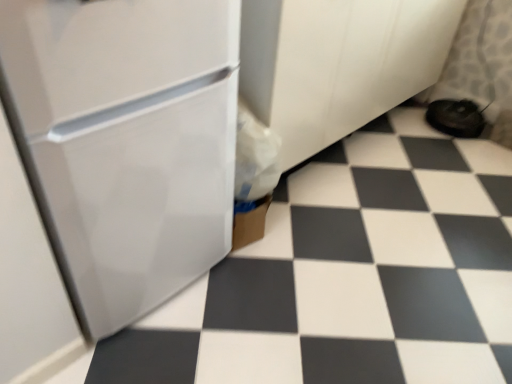
What do you see at coordinates (125, 142) in the screenshot?
I see `white glossy refrigerator at left` at bounding box center [125, 142].

Where is `white glossy tile at center`? Image resolution: width=512 pixels, height=384 pixels. white glossy tile at center is located at coordinates (351, 275).

Which of these two, white glossy tile at center or black fabric shoe at lower right, is thinner?

Thinner between the two is black fabric shoe at lower right.

Is white glossy tile at center facing away from black fabric shoe at lower right?

white glossy tile at center is not turned away from black fabric shoe at lower right.

Does white glossy tile at center have a smaller size compared to black fabric shoe at lower right?

Actually, white glossy tile at center might be larger than black fabric shoe at lower right.

How different are the orientations of white glossy tile at center and black fabric shoe at lower right in degrees?

The angular difference between white glossy tile at center and black fabric shoe at lower right is 180 degrees.

Considering the relative positions of white glossy tile at center and white glossy refrigerator at left in the image provided, is white glossy tile at center to the right of white glossy refrigerator at left from the viewer's perspective?

Indeed, white glossy tile at center is positioned on the right side of white glossy refrigerator at left.

The width and height of the screenshot is (512, 384). In order to click on refrigerator that appears above the white glossy tile at center (from the image's perspective) in this screenshot , I will do `click(125, 142)`.

Is white glossy tile at center turned away from white glossy refrigerator at left?

No, white glossy tile at center is not facing the opposite direction of white glossy refrigerator at left.

Can you tell me how much white glossy tile at center and white glossy refrigerator at left differ in facing direction?

The facing directions of white glossy tile at center and white glossy refrigerator at left are 89.8 degrees apart.

Which is correct: white glossy refrigerator at left is inside white glossy tile at center, or outside of it?

white glossy refrigerator at left lies outside white glossy tile at center.

Between white glossy refrigerator at left and white glossy tile at center, which one has smaller width?

white glossy refrigerator at left.

Can white glossy tile at center be found inside black fabric shoe at lower right?

No, white glossy tile at center is not inside black fabric shoe at lower right.

Relative to white glossy tile at center, is black fabric shoe at lower right in front or behind?

Clearly, black fabric shoe at lower right is behind white glossy tile at center.

Could you tell me if black fabric shoe at lower right is turned towards white glossy tile at center?

Yes, black fabric shoe at lower right is facing white glossy tile at center.

How many degrees apart are the facing directions of black fabric shoe at lower right and white glossy tile at center?

The angle between the facing direction of black fabric shoe at lower right and the facing direction of white glossy tile at center is 180 degrees.

Based on the photo, are white glossy refrigerator at left and black fabric shoe at lower right far apart?

Yes.

From the image's perspective, between white glossy refrigerator at left and black fabric shoe at lower right, which one is located above?

From the image's view, black fabric shoe at lower right is above.

Which object is further away from the camera, white glossy refrigerator at left or black fabric shoe at lower right?

black fabric shoe at lower right is further away from the camera.

From the image's perspective, between black fabric shoe at lower right and white glossy refrigerator at left, who is located below?

white glossy refrigerator at left appears lower in the image.

In terms of width, does black fabric shoe at lower right look wider or thinner when compared to white glossy refrigerator at left?

Considering their sizes, black fabric shoe at lower right looks slimmer than white glossy refrigerator at left.

Is black fabric shoe at lower right at the right side of white glossy refrigerator at left?

Yes.

Would you say white glossy refrigerator at left is part of black fabric shoe at lower right's contents?

Actually, white glossy refrigerator at left is outside black fabric shoe at lower right.

This screenshot has height=384, width=512. Identify the location of footwear on the right of white glossy tile at center. (456, 117).

The width and height of the screenshot is (512, 384). What are the coordinates of `refrigerator in front of the white glossy tile at center` in the screenshot? It's located at (125, 142).

When comparing their distances from black fabric shoe at lower right, does white glossy tile at center or white glossy refrigerator at left seem closer?

white glossy tile at center.

Considering their positions, is black fabric shoe at lower right positioned closer to white glossy tile at center than white glossy refrigerator at left?

white glossy refrigerator at left lies closer to white glossy tile at center than the other object.

Based on the photo, when comparing their distances from white glossy tile at center, does white glossy refrigerator at left or black fabric shoe at lower right seem closer?

white glossy refrigerator at left is closer to white glossy tile at center.

Looking at the image, which one is located closer to white glossy refrigerator at left, white glossy tile at center or black fabric shoe at lower right?

white glossy tile at center.

Based on the photo, from the image, which object appears to be farther from black fabric shoe at lower right, white glossy refrigerator at left or white glossy tile at center?

white glossy refrigerator at left is positioned further to the anchor black fabric shoe at lower right.

When comparing their distances from white glossy refrigerator at left, does black fabric shoe at lower right or white glossy tile at center seem closer?

white glossy tile at center is positioned closer to the anchor white glossy refrigerator at left.

You are a GUI agent. You are given a task and a screenshot of the screen. Output one action in this format:
    pyautogui.click(x=<x>, y=<y>)
    Task: Click on the tile positioned between white glossy refrigerator at left and black fabric shoe at lower right from near to far
    This screenshot has height=384, width=512.
    Given the screenshot: What is the action you would take?
    pyautogui.click(x=351, y=275)